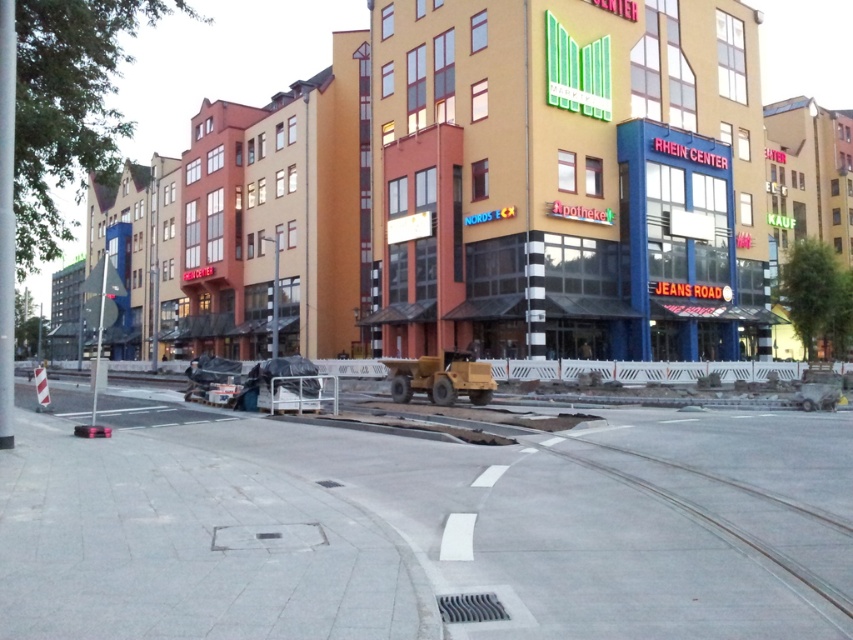
Question: Among these objects, which one is farthest from the camera?

Choices:
 (A) gray concrete train track at lower right
 (B) concrete at center

Answer: (A)

Question: Considering the relative positions of concrete at center and gray concrete train track at lower right in the image provided, where is concrete at center located with respect to gray concrete train track at lower right?

Choices:
 (A) left
 (B) right

Answer: (A)

Question: Which point is closer to the camera?

Choices:
 (A) (306, 444)
 (B) (764, 547)

Answer: (B)

Question: Is concrete at center wider than gray concrete train track at lower right?

Choices:
 (A) no
 (B) yes

Answer: (B)

Question: Can you confirm if concrete at center is smaller than gray concrete train track at lower right?

Choices:
 (A) no
 (B) yes

Answer: (A)